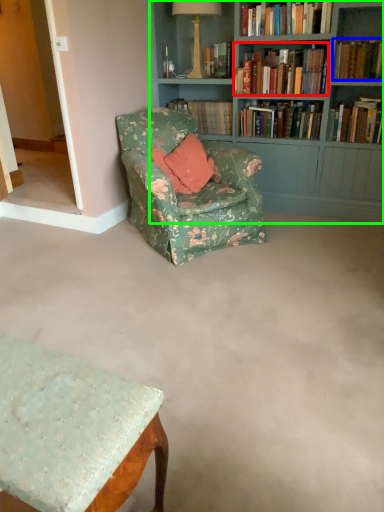
Question: Which object is positioned farthest from book (highlighted by a red box)? Select from book (highlighted by a blue box) and bookcase (highlighted by a green box).

Choices:
 (A) book
 (B) bookcase

Answer: (A)